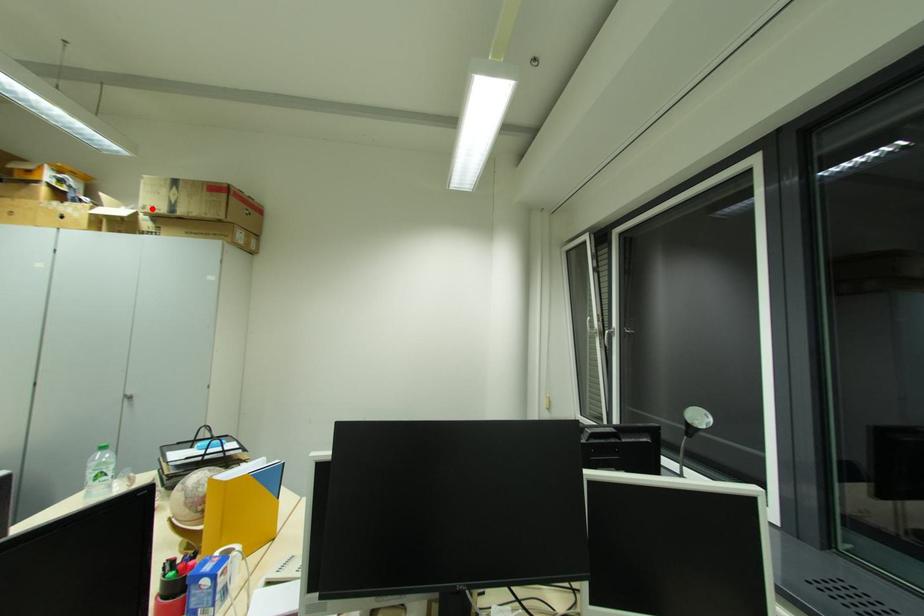
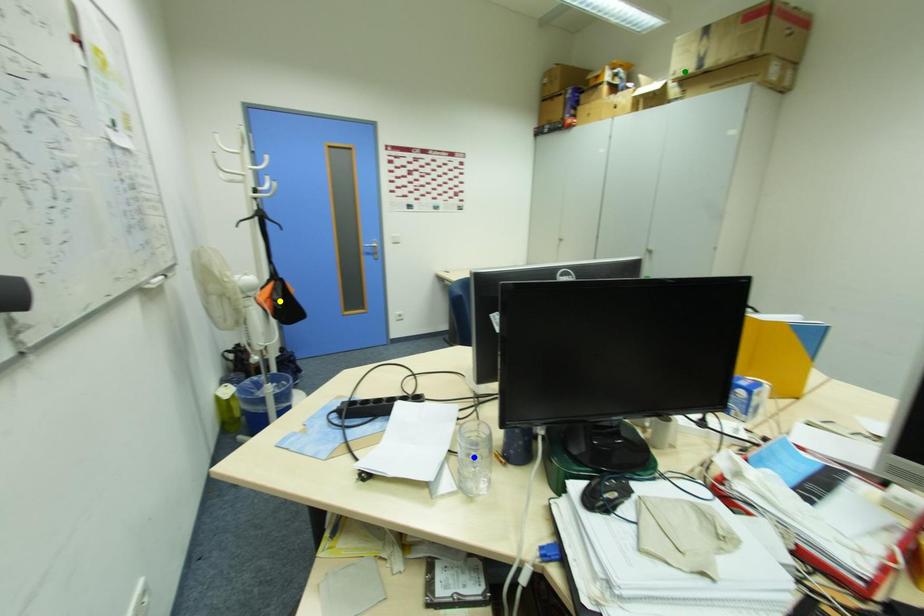
Question: I am providing you with two images of the same scene from different viewpoints. A red point is marked on the first image. You are given multiple points on the second image. Which point in image 2 is actually the same real-world point as the red point in image 1?

Choices:
 (A) blue point
 (B) yellow point
 (C) green point

Answer: (C)